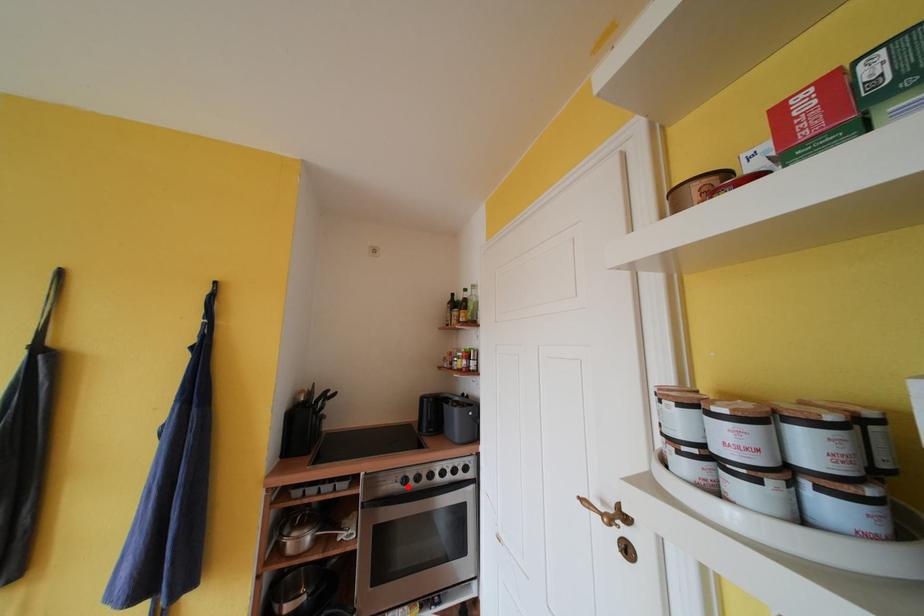
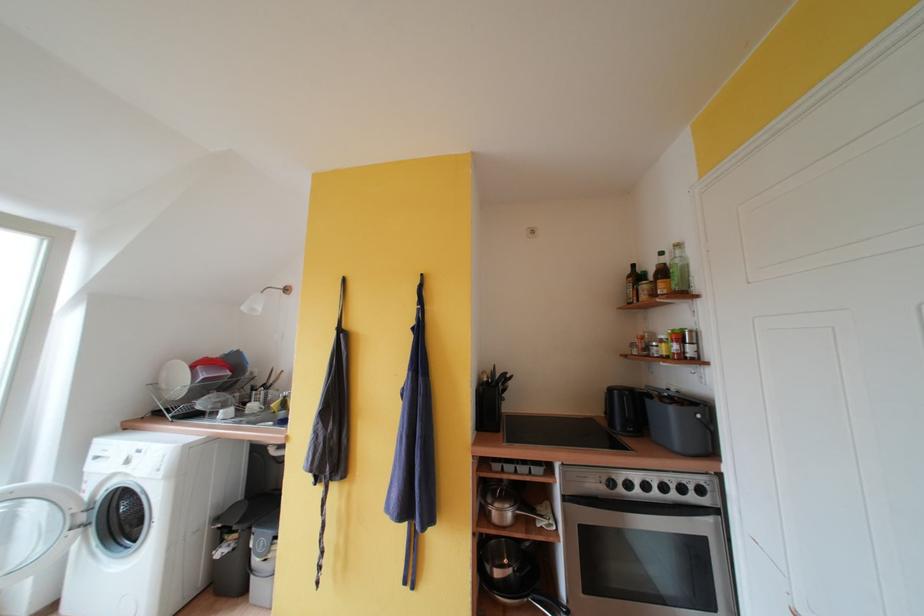
In the second image, find the point that corresponds to the highlighted location in the first image.

(614, 490)